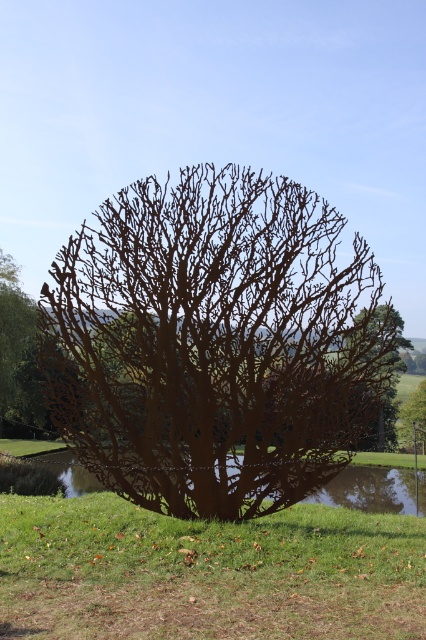
Is point (291, 268) closer to camera compared to point (405, 419)?

Yes, point (291, 268) is closer to viewer.

Does rusty metal tree at center have a greater height compared to rustic wood tree at center?

No.

Is point (189, 216) closer to camera compared to point (397, 429)?

Yes, it is in front of point (397, 429).

Find the location of a particular element. rusty metal tree at center is located at coordinates (213, 342).